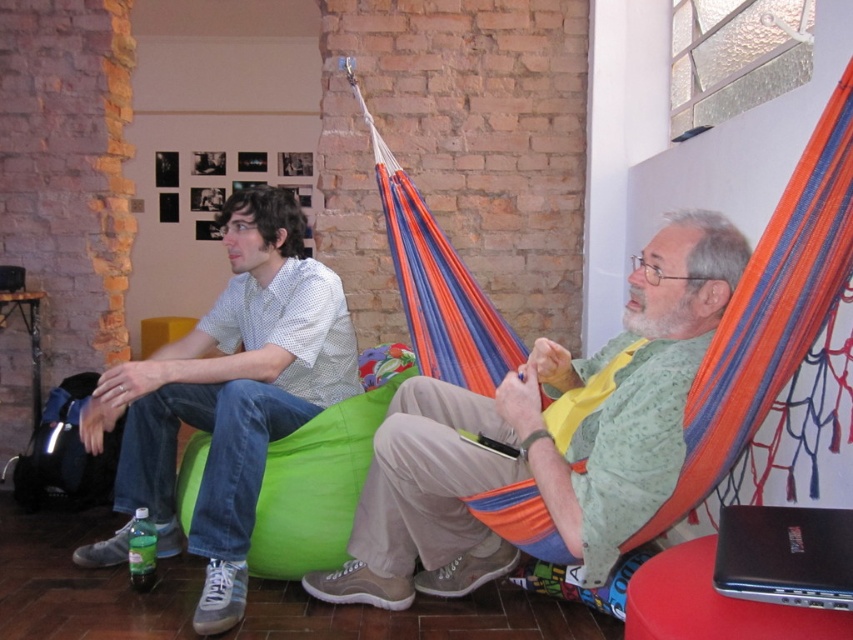
Question: Which point appears closest to the camera in this image?

Choices:
 (A) (318, 412)
 (B) (792, 529)
 (C) (299, 465)
 (D) (440, 572)

Answer: (B)

Question: Does green fabric hammock at center have a smaller size compared to matte white shirt at left?

Choices:
 (A) yes
 (B) no

Answer: (B)

Question: Does matte white shirt at left have a lesser width compared to black plastic laptop at lower right?

Choices:
 (A) yes
 (B) no

Answer: (B)

Question: Does green fabric hammock at center appear on the right side of matte white shirt at left?

Choices:
 (A) no
 (B) yes

Answer: (B)

Question: Which of the following is the farthest from the observer?

Choices:
 (A) matte white shirt at left
 (B) black plastic laptop at lower right

Answer: (A)

Question: Which is farther from the matte white shirt at left?

Choices:
 (A) green fabric bean bag at lower left
 (B) black plastic laptop at lower right
 (C) green fabric hammock at center

Answer: (B)